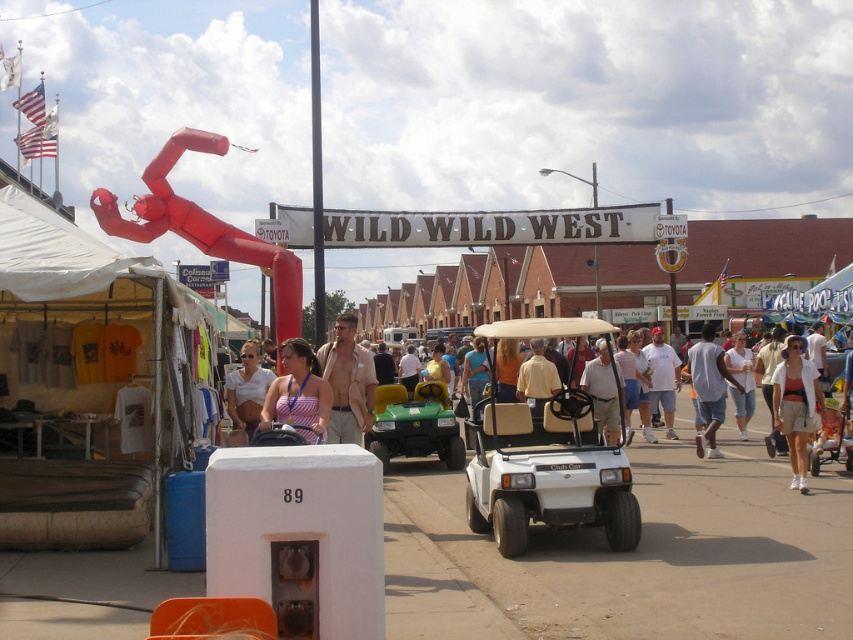
In the scene shown: Between white matte golf cart at center and light blue denim shorts at center, which one has more height?

With more height is light blue denim shorts at center.

What do you see at coordinates (550, 449) in the screenshot?
I see `white matte golf cart at center` at bounding box center [550, 449].

This screenshot has height=640, width=853. I want to click on white matte golf cart at center, so click(550, 449).

How distant is white matte golf cart at center from green matte golf cart at center?

white matte golf cart at center and green matte golf cart at center are 5.37 meters apart from each other.

Is point (535, 333) farther from camera compared to point (416, 444)?

No, it is in front of (416, 444).

The image size is (853, 640). What do you see at coordinates (550, 449) in the screenshot? I see `white matte golf cart at center` at bounding box center [550, 449].

Locate an element on the screen. The width and height of the screenshot is (853, 640). white matte golf cart at center is located at coordinates (550, 449).

Where is `white matte golf cart at center`? This screenshot has width=853, height=640. white matte golf cart at center is located at coordinates (550, 449).

Between white matte golf cart at center and matte white tank top at center, which one has less height?

matte white tank top at center is shorter.

This screenshot has height=640, width=853. What do you see at coordinates (550, 449) in the screenshot?
I see `white matte golf cart at center` at bounding box center [550, 449].

This screenshot has height=640, width=853. In order to click on white matte golf cart at center in this screenshot , I will do `click(550, 449)`.